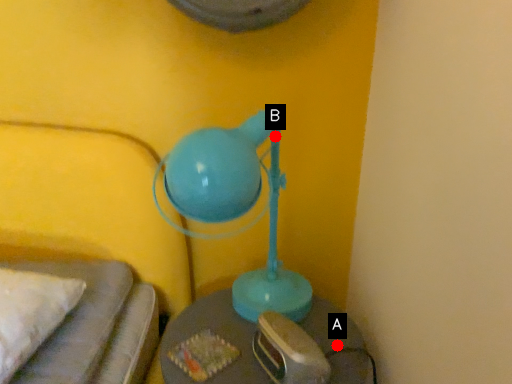
Question: Two points are circled on the image, labeled by A and B beside each circle. Which point is closer to the camera?

Choices:
 (A) A is closer
 (B) B is closer

Answer: (B)